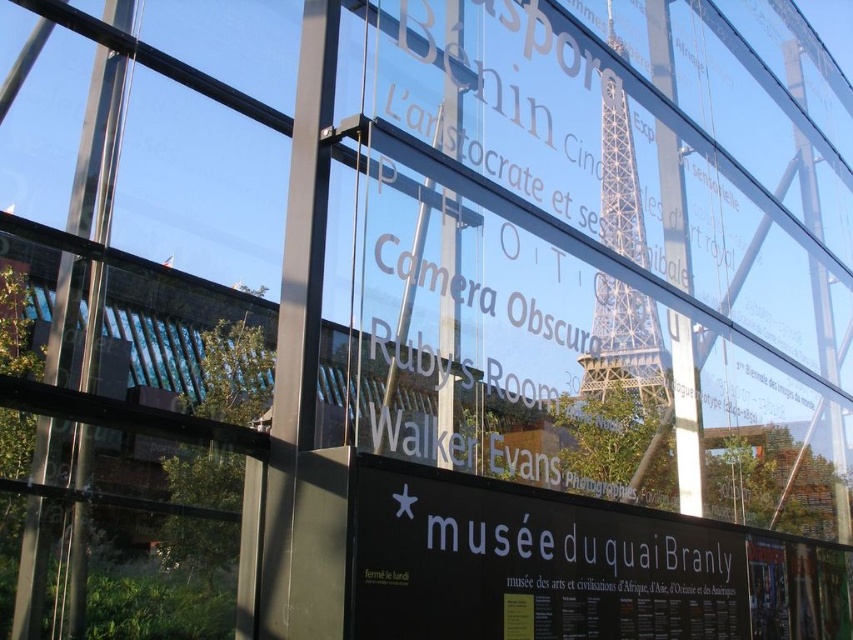
Does point (527, 545) lie behind point (606, 90)?

No, it is not.

The height and width of the screenshot is (640, 853). Find the location of `black matte sign at center`. black matte sign at center is located at coordinates (531, 564).